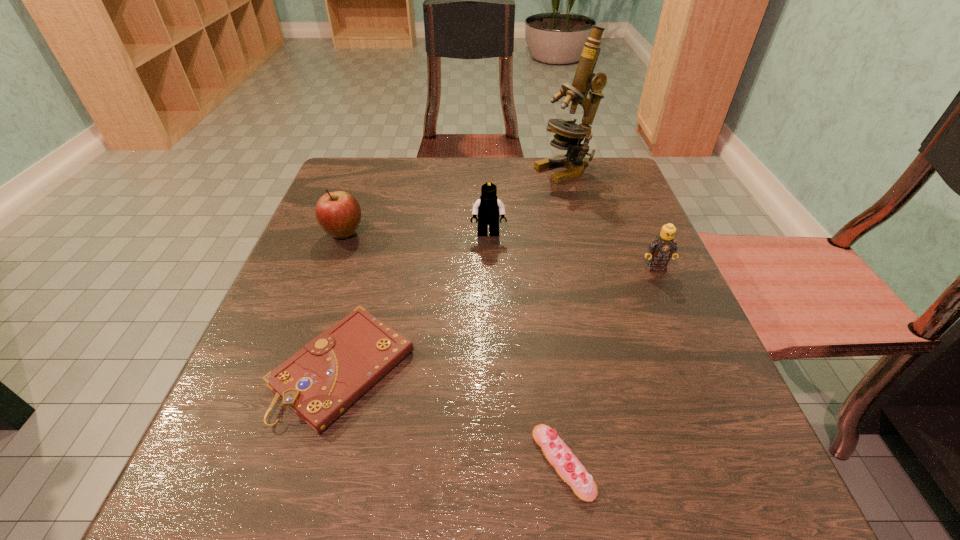
The height and width of the screenshot is (540, 960). In order to click on the farthest object in this screenshot , I will do `click(569, 135)`.

The height and width of the screenshot is (540, 960). Find the location of `microscope`. microscope is located at coordinates (569, 135).

At what (x,y) coordinates should I click in order to perform the action: click on the fourth object from right to left. Please return your answer as a coordinate pair (x, y). The width and height of the screenshot is (960, 540). Looking at the image, I should click on (488, 208).

The width and height of the screenshot is (960, 540). What are the coordinates of `the farther Lego` in the screenshot? It's located at (488, 208).

This screenshot has height=540, width=960. I want to click on apple, so click(338, 213).

The height and width of the screenshot is (540, 960). Find the location of `the rightmost object`. the rightmost object is located at coordinates (663, 247).

Find the location of a particular element. the right Lego is located at coordinates (663, 247).

This screenshot has width=960, height=540. I want to click on notebook, so click(x=321, y=381).

You are a GUI agent. You are given a task and a screenshot of the screen. Output one action in this format:
    pyautogui.click(x=<x>, y=<y>)
    Task: Click on the eclair
    
    Given the screenshot: What is the action you would take?
    [x=558, y=454]

Find the location of a particular element. Image resolution: width=960 pixels, height=540 pixels. vacant region located 0.340m on the front of the microscope is located at coordinates (595, 280).